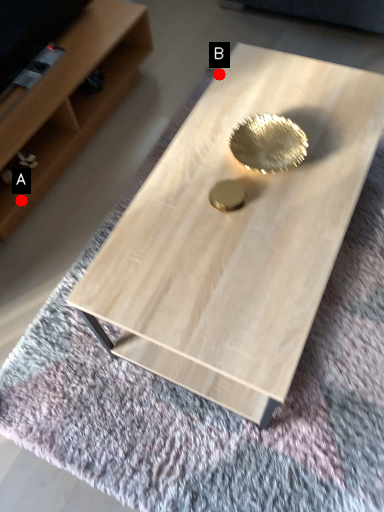
Question: Two points are circled on the image, labeled by A and B beside each circle. Among these points, which one is farthest from the camera?

Choices:
 (A) A is further
 (B) B is further

Answer: (A)